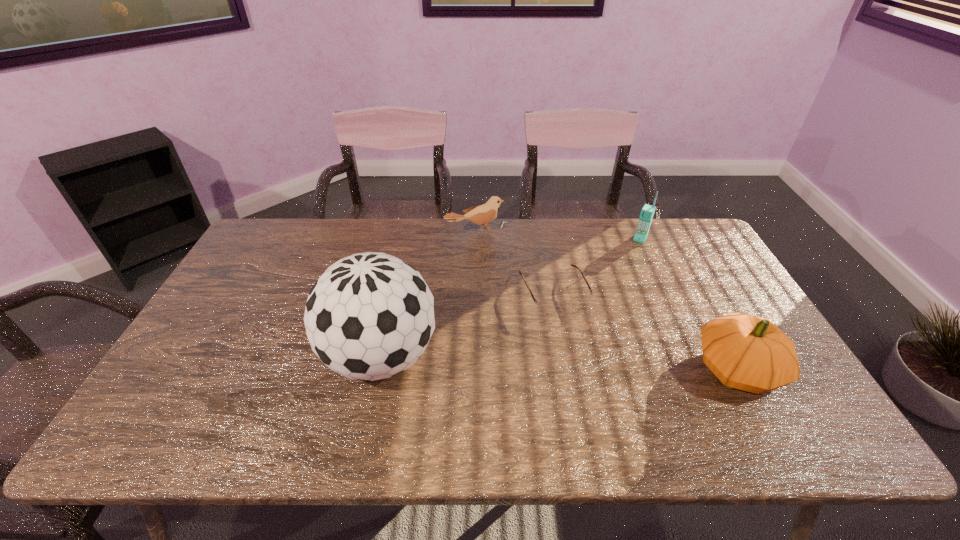
Identify the location of the tallest object. (370, 316).

Locate an element on the screen. This screenshot has width=960, height=540. gourd is located at coordinates (x=749, y=353).

Identify the location of cellular telephone. (647, 212).

The height and width of the screenshot is (540, 960). Identify the location of the second shortest object. (481, 215).

The width and height of the screenshot is (960, 540). Identify the location of spectacles. (549, 307).

Locate an element on the screen. The height and width of the screenshot is (540, 960). the shortest object is located at coordinates (549, 307).

Image resolution: width=960 pixels, height=540 pixels. In order to click on free point located on the left of the soccer ball in this screenshot , I will do `click(227, 357)`.

Identify the location of vacant region located 0.100m on the keypad of the cellular telephone. The height and width of the screenshot is (540, 960). (629, 259).

The width and height of the screenshot is (960, 540). In order to click on free spot located on the keypad of the cellular telephone in this screenshot , I will do `click(631, 256)`.

Identify the location of free region located 0.090m on the keypad of the cellular telephone. Image resolution: width=960 pixels, height=540 pixels. (630, 258).